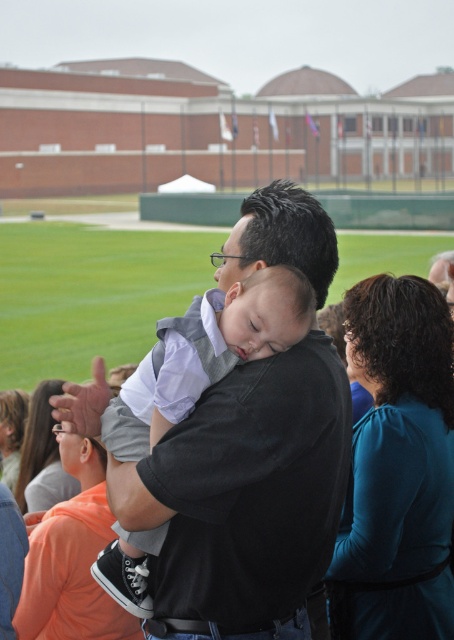
The height and width of the screenshot is (640, 454). Identify the location of black cotton shirt at center. (246, 490).

Does black cotton shirt at center have a greater width compared to teal fabric shirt at lower left?

Indeed, black cotton shirt at center has a greater width compared to teal fabric shirt at lower left.

Is point (232, 472) in front of point (52, 392)?

Yes, it is in front of point (52, 392).

At what (x,y) coordinates should I click in order to perform the action: click on black cotton shirt at center. Please return your answer as a coordinate pair (x, y). The image size is (454, 640). Looking at the image, I should click on (246, 490).

Is black cotton shirt at center below teal fabric shirt at right?

Actually, black cotton shirt at center is above teal fabric shirt at right.

Which of these two, black cotton shirt at center or teal fabric shirt at right, stands shorter?

Standing shorter between the two is teal fabric shirt at right.

Which is in front, point (181, 436) or point (404, 509)?

Point (181, 436) is in front.

The height and width of the screenshot is (640, 454). What are the coordinates of `black cotton shirt at center` in the screenshot? It's located at (246, 490).

Is teal fabric shirt at lower left wider than teal fabric dress at lower left?

Indeed, teal fabric shirt at lower left has a greater width compared to teal fabric dress at lower left.

Does point (19, 464) lie behind point (10, 467)?

No, (19, 464) is closer to viewer.

The width and height of the screenshot is (454, 640). I want to click on teal fabric shirt at lower left, so click(x=42, y=456).